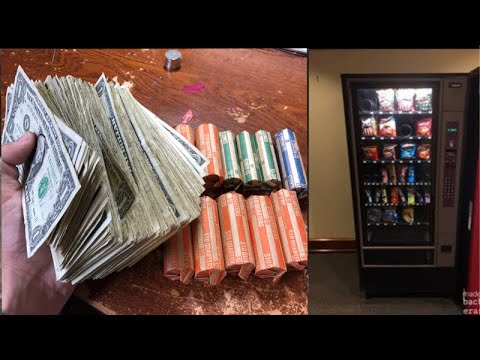
At what (x,y) coordinates should I click in order to perform the action: click on vending machine. Please return your answer as a coordinate pair (x, y). This screenshot has height=360, width=480. Looking at the image, I should click on (435, 242).